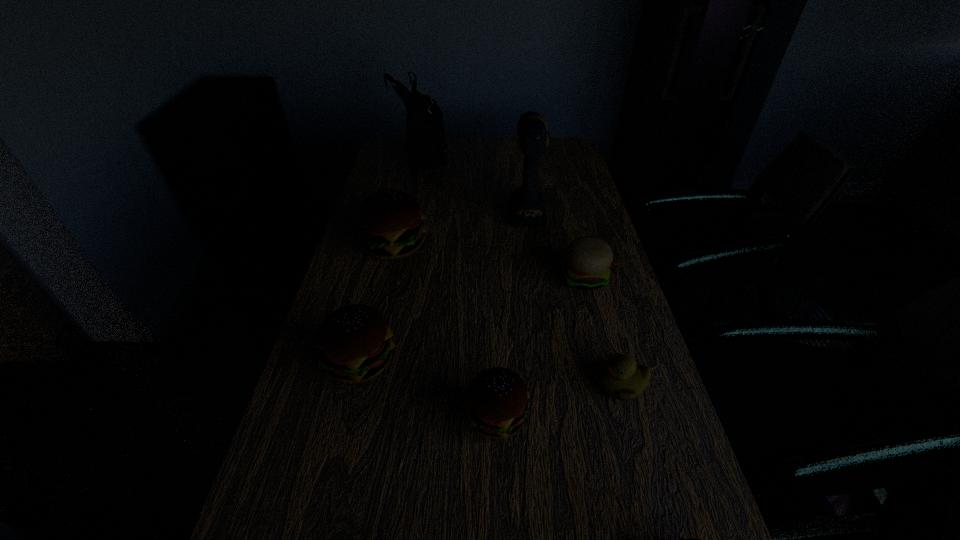
Identify the location of shoulder bag. (425, 135).

The image size is (960, 540). I want to click on the farthest object, so click(x=425, y=135).

Identify the location of drill. (527, 208).

Where is `the tallest hamburger`? Image resolution: width=960 pixels, height=540 pixels. the tallest hamburger is located at coordinates (391, 225).

This screenshot has width=960, height=540. Identify the location of the third tallest object. (391, 225).

You are a GUI agent. You are given a task and a screenshot of the screen. Output one action in this format:
    pyautogui.click(x=<x>, y=<y>)
    Task: Click on the fifth shortest object
    The image size is (960, 540).
    Given the screenshot: What is the action you would take?
    pyautogui.click(x=354, y=342)

Where is `the third smallest brown hamburger`? the third smallest brown hamburger is located at coordinates (354, 342).

I want to click on the second smallest brown hamburger, so click(x=497, y=399).

Identify the location of the third brown hamburger from left to right. This screenshot has width=960, height=540. point(497,399).

Find the location of `beige hamburger`. beige hamburger is located at coordinates (588, 259).